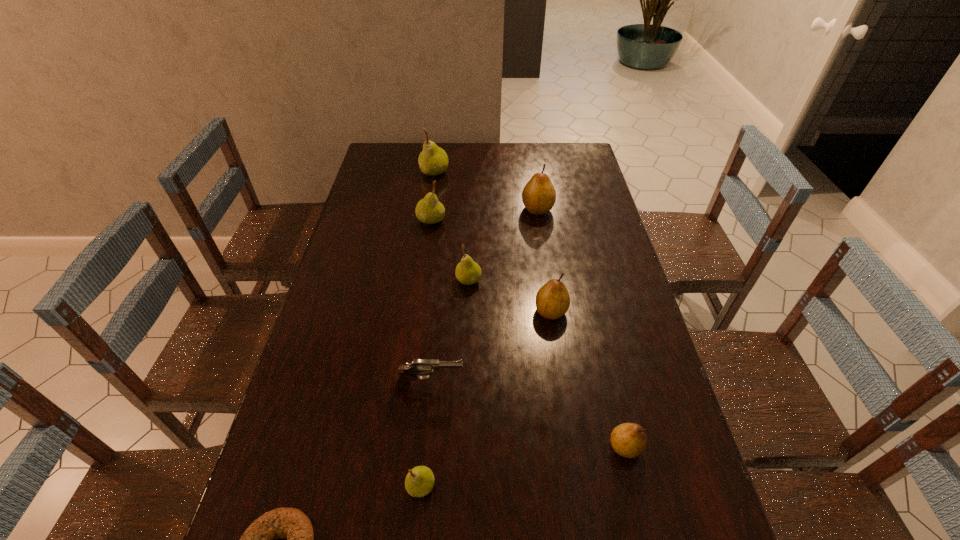
At what (x,y) coordinates should I click in order to perform the action: click on vacant point located between the pistol and the farthest green pear. Please return your answer as a coordinate pair (x, y). The image size is (960, 540). Looking at the image, I should click on (431, 279).

Where is `vacant area that lies between the third nearest pear and the gray pistol`? vacant area that lies between the third nearest pear and the gray pistol is located at coordinates (490, 349).

This screenshot has width=960, height=540. Identify the location of vacant area between the nearest green pear and the gray pistol. coord(424,436).

Locate an element on the screen. The image size is (960, 540). empty space that is in between the rightmost brown pear and the fourth nearest object is located at coordinates (527, 416).

In order to click on free space between the tallest object and the second farthest brown pear in this screenshot , I will do `click(492, 241)`.

I want to click on object that is the third closest to the biggest brown pear, so click(x=433, y=160).

Identify the location of object that stands as the sixth closest to the pistol. Image resolution: width=960 pixels, height=540 pixels. (429, 210).

Locate which pear ranks fifth in proximity to the second biggest green pear. Please provide its 2D coordinates. Your answer should be formatted as a tuple, i.e. [(x, y)], where the tuple contains the x and y coordinates of a point satisfying the conditions above.

[(419, 482)]

You are a GUI agent. You are given a task and a screenshot of the screen. Output one action in this format:
    pyautogui.click(x=<x>, y=<y>)
    Task: Click on the fifth closest pear to the brown bagel
    The image size is (960, 540).
    Given the screenshot: What is the action you would take?
    pyautogui.click(x=429, y=210)

Point out which green pear is positioned as the third nearest to the fourth nearest pear. Please provide its 2D coordinates. Your answer should be formatted as a tuple, i.e. [(x, y)], where the tuple contains the x and y coordinates of a point satisfying the conditions above.

[(419, 482)]